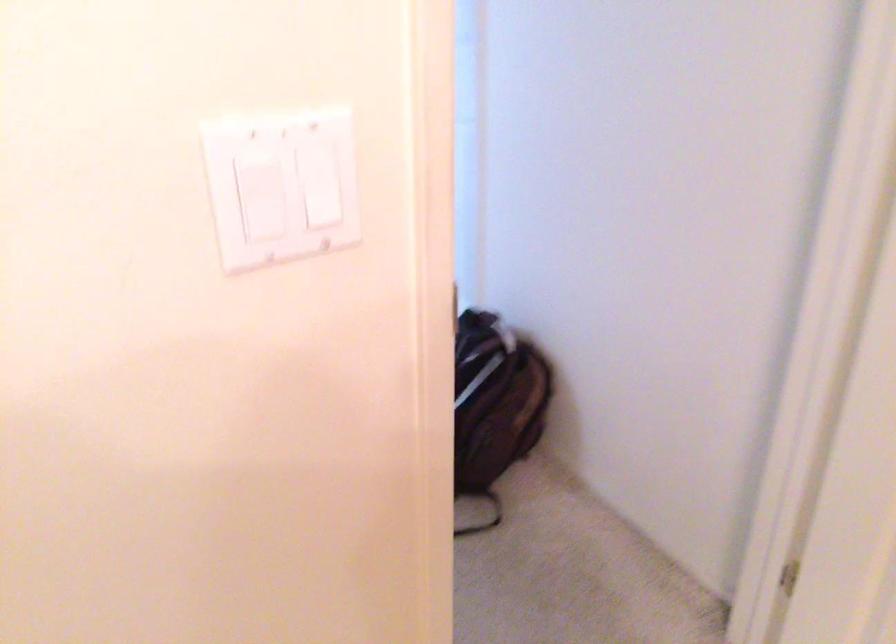
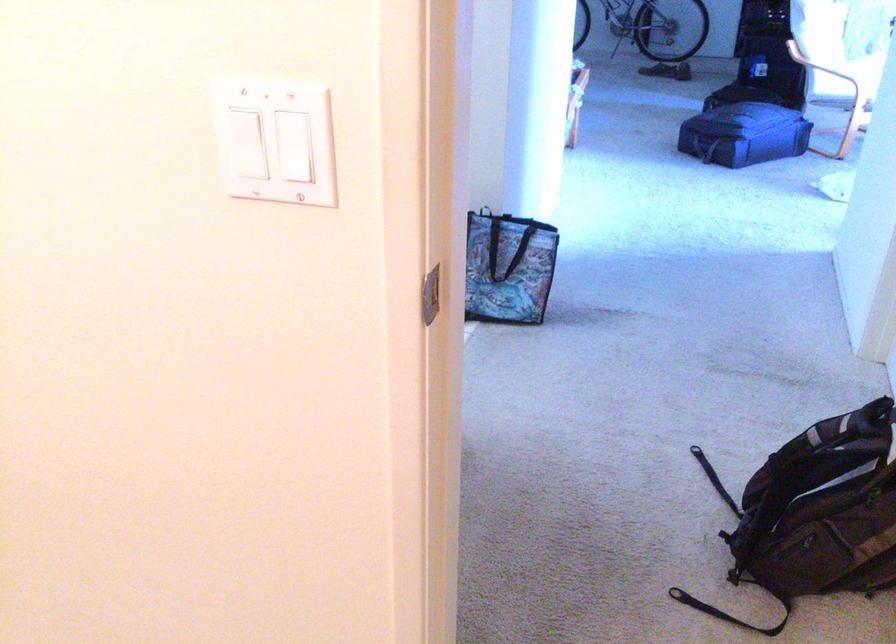
In the second image, find the point that corresponds to pixel 495 420 in the first image.

(826, 516)